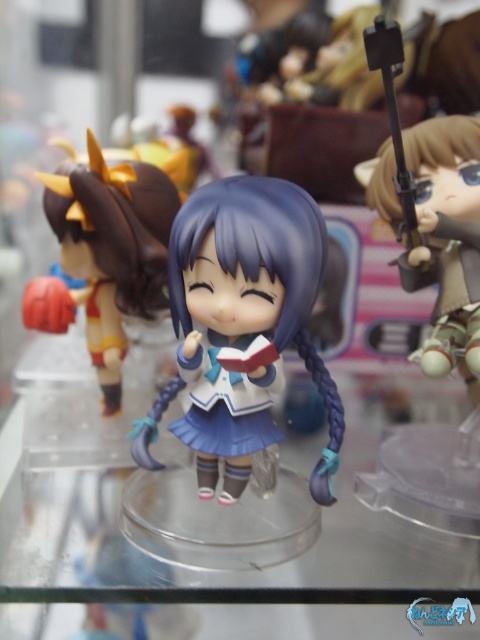
Between transparent plastic glass table at center and satin purple doll at center, which one has less height?

transparent plastic glass table at center is shorter.

Is point (292, 630) positioned in front of point (71, 195)?

Yes, point (292, 630) is closer to viewer.

Where is `transparent plastic glass table at center`? This screenshot has width=480, height=640. transparent plastic glass table at center is located at coordinates (228, 572).

In the scene shown: Is transparent plastic glass table at center further to the viewer compared to satin blue dress at center?

No.

Between point (393, 563) and point (190, 284), which one is positioned in front?

Point (190, 284)

You are a GUI agent. You are given a task and a screenshot of the screen. Output one action in this format:
    pyautogui.click(x=<x>, y=<y>)
    Task: Click on the transparent plastic glass table at center
    
    Given the screenshot: What is the action you would take?
    pyautogui.click(x=228, y=572)

Does point (225, 227) come in front of point (122, 221)?

Yes, point (225, 227) is in front of point (122, 221).

Who is lower down, satin blue dress at center or satin purple doll at center?

satin blue dress at center is lower down.

Is point (307, 291) closer to viewer compared to point (159, 252)?

Yes.

At what (x,y) coordinates should I click in order to perform the action: click on satin blue dress at center. Please return your answer as a coordinate pair (x, y). This screenshot has height=640, width=480. Looking at the image, I should click on (245, 321).